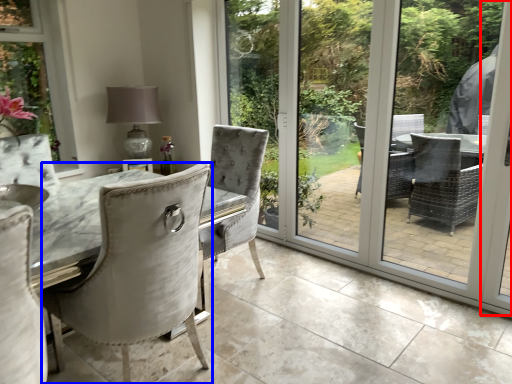
Question: Which object is closer to the camera taking this photo, screen door (highlighted by a red box) or chair (highlighted by a blue box)?

Choices:
 (A) screen door
 (B) chair

Answer: (B)